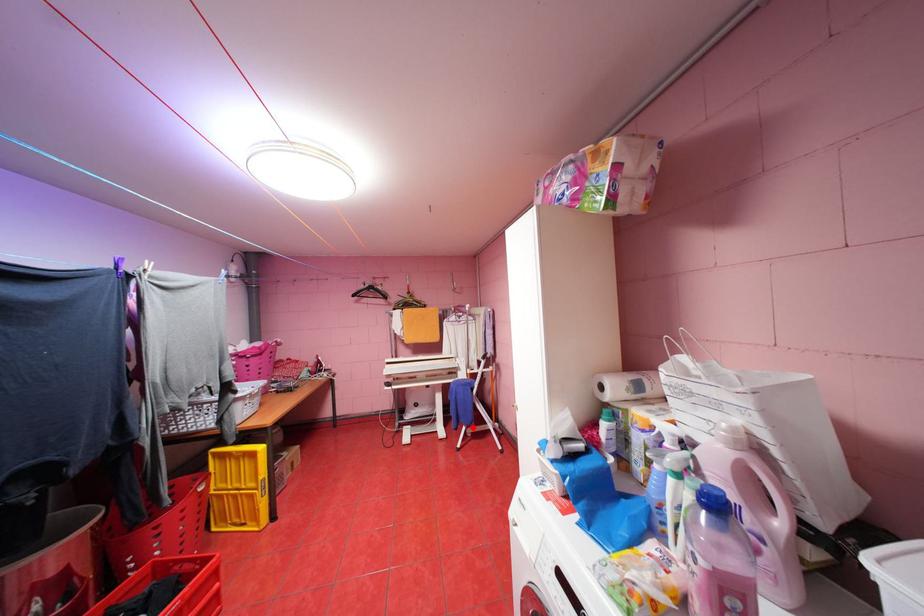
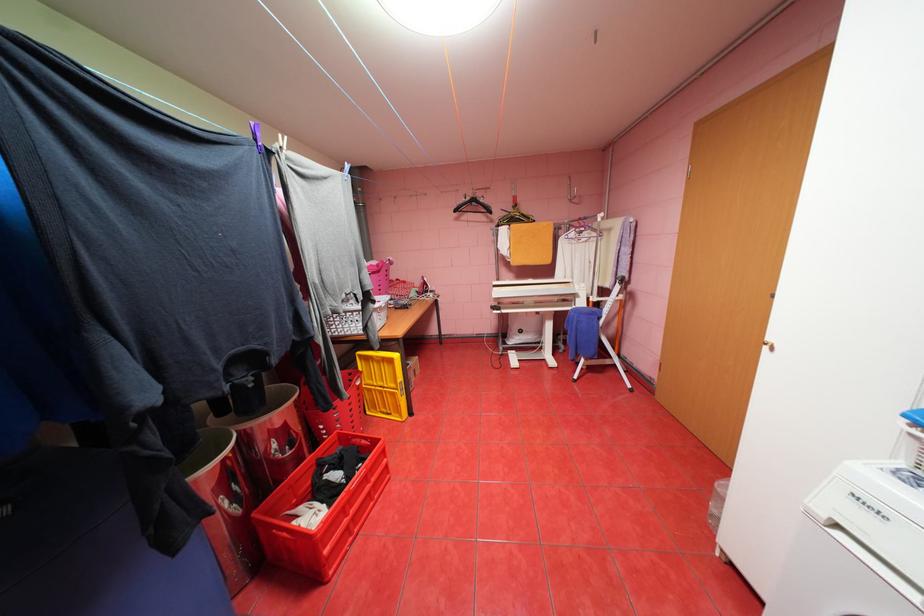
Question: I am providing you with two images of the same scene from different viewpoints. A red point is marked on the first image. Is the red point's position out of view in image 2?

Choices:
 (A) Yes
 (B) No

Answer: (B)